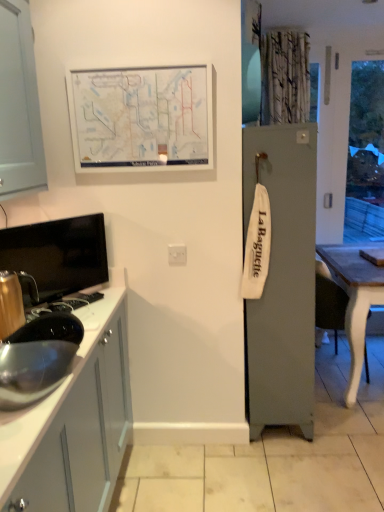
Question: In terms of height, does white matte map at upper center look taller or shorter compared to metallic gold kettle at left?

Choices:
 (A) short
 (B) tall

Answer: (B)

Question: In the image, is white matte map at upper center on the left side or the right side of metallic gold kettle at left?

Choices:
 (A) right
 (B) left

Answer: (A)

Question: Which object is positioned farthest from the wooden table at right?

Choices:
 (A) white matte map at upper center
 (B) white plastic electric outlet at center
 (C) satin silver sink at lower left
 (D) metallic gold kettle at left

Answer: (D)

Question: Based on their relative distances, which object is nearer to the satin silver sink at lower left?

Choices:
 (A) wooden table at right
 (B) metallic gold kettle at left
 (C) white plastic electric outlet at center
 (D) white matte map at upper center

Answer: (B)